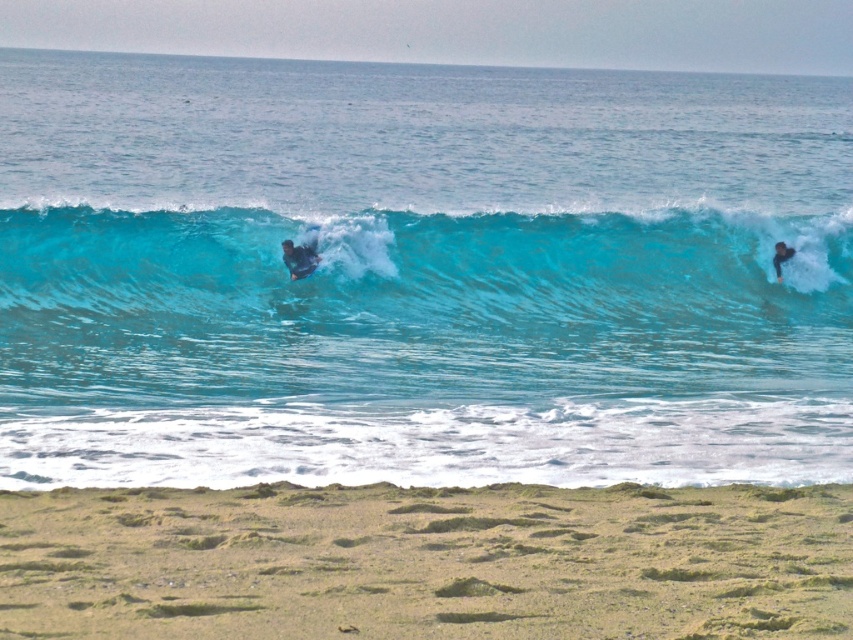
Question: Does translucent blue water at center appear under dark blue wetsuit at right?

Choices:
 (A) yes
 (B) no

Answer: (B)

Question: Does blue glossy water at center appear over translucent blue water at center?

Choices:
 (A) no
 (B) yes

Answer: (B)

Question: Which of the following is the closest to the observer?

Choices:
 (A) grainy sand at lower center
 (B) dark blue wetsuit at right
 (C) blue glossy water at center

Answer: (A)

Question: Which point is farther to the camera?

Choices:
 (A) smooth black wetsuit at center
 (B) dark blue wetsuit at right
 (C) grainy sand at lower center
 (D) translucent blue water at center

Answer: (B)

Question: Based on their relative distances, which object is nearer to the grainy sand at lower center?

Choices:
 (A) smooth black wetsuit at center
 (B) translucent blue water at center
 (C) blue glossy water at center
 (D) dark blue wetsuit at right

Answer: (B)

Question: Can you confirm if grainy sand at lower center is positioned to the right of translucent blue water at center?

Choices:
 (A) yes
 (B) no

Answer: (B)